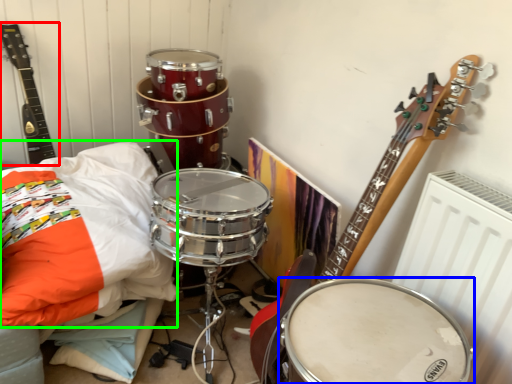
Question: Estimate the real-world distances between objects in this image. Which object is farther from guitar (highlighted by a red box), drum (highlighted by a blue box) or pillow (highlighted by a green box)?

Choices:
 (A) drum
 (B) pillow

Answer: (A)